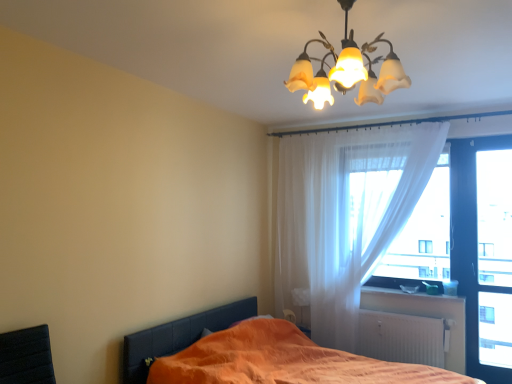
What is the approximate height of translucent fabric at right, arranged as the second window screen when viewed from the right?

translucent fabric at right, arranged as the second window screen when viewed from the right, is 4.60 feet in height.

At what (x,y) coordinates should I click in order to perform the action: click on white matte radiator at lower right. Please return your answer as a coordinate pair (x, y). Looking at the image, I should click on (403, 338).

The width and height of the screenshot is (512, 384). What are the coordinates of `orange fabric bed at lower left` in the screenshot? It's located at (292, 366).

From a real-world perspective, is translucent white curtain at upper right on translucent glass chandelier at upper center?

No, from a real-world perspective, translucent white curtain at upper right is not above translucent glass chandelier at upper center.

Looking at their sizes, would you say translucent white curtain at upper right is wider or thinner than translucent glass chandelier at upper center?

Clearly, translucent white curtain at upper right has less width compared to translucent glass chandelier at upper center.

Is translucent white curtain at upper right in contact with translucent glass chandelier at upper center?

translucent white curtain at upper right is not next to translucent glass chandelier at upper center, and they're not touching.

How far apart are orange fabric bed at lower left and white matte radiator at lower right?

The distance of orange fabric bed at lower left from white matte radiator at lower right is 27.83 inches.

Considering the relative sizes of orange fabric bed at lower left and white matte radiator at lower right in the image provided, is orange fabric bed at lower left smaller than white matte radiator at lower right?

Incorrect, orange fabric bed at lower left is not smaller in size than white matte radiator at lower right.

Is orange fabric bed at lower left looking in the opposite direction of white matte radiator at lower right?

No, orange fabric bed at lower left is not facing away from white matte radiator at lower right.

Based on the photo, is orange fabric bed at lower left positioned far away from white matte radiator at lower right?

Actually, orange fabric bed at lower left and white matte radiator at lower right are a little close together.

Is transparent glass door at right, the 1th window screen positioned from the right, behind orange fabric bed at lower left?

Yes, it is behind orange fabric bed at lower left.

Is transparent glass door at right, the 1th window screen positioned from the right, aimed at orange fabric bed at lower left?

No, transparent glass door at right, the 1th window screen positioned from the right, does not turn towards orange fabric bed at lower left.

How distant is transparent glass door at right, the 1th window screen positioned from the right, from orange fabric bed at lower left?

A distance of 1.49 meters exists between transparent glass door at right, the 1th window screen positioned from the right, and orange fabric bed at lower left.

Identify the location of radiator below the translucent glass chandelier at upper center (from the image's perspective). Image resolution: width=512 pixels, height=384 pixels. (403, 338).

How different are the orientations of translucent glass chandelier at upper center and white matte radiator at lower right in degrees?

The angular difference between translucent glass chandelier at upper center and white matte radiator at lower right is 1.68 degrees.

Would you say translucent glass chandelier at upper center is a long distance from white matte radiator at lower right?

Yes.

From a real-world perspective, between transparent glass door at right, marked as the 2th window screen in a left-to-right arrangement, and translucent glass chandelier at upper center, who is vertically higher?

In real-world perspective, translucent glass chandelier at upper center is above.

From the image's perspective, who appears lower, transparent glass door at right, marked as the 2th window screen in a left-to-right arrangement, or translucent glass chandelier at upper center?

transparent glass door at right, marked as the 2th window screen in a left-to-right arrangement.

Is transparent glass door at right, marked as the 2th window screen in a left-to-right arrangement, placed right next to translucent glass chandelier at upper center?

transparent glass door at right, marked as the 2th window screen in a left-to-right arrangement, and translucent glass chandelier at upper center are not in contact.

Choose the correct answer: Is transparent glass door at right, marked as the 2th window screen in a left-to-right arrangement, inside translucent glass chandelier at upper center or outside it?

transparent glass door at right, marked as the 2th window screen in a left-to-right arrangement, is located beyond the bounds of translucent glass chandelier at upper center.

Which is more to the right, white plastic window sill at lower right or white matte radiator at lower right?

white plastic window sill at lower right is more to the right.

Is point (437, 299) in front of point (381, 327)?

Yes, it is in front of point (381, 327).

Is white plastic window sill at lower right positioned with its back to white matte radiator at lower right?

That's not correct — white plastic window sill at lower right is not looking away from white matte radiator at lower right.

From a real-world perspective, is white plastic window sill at lower right above or below orange fabric bed at lower left?

From a real-world perspective, white plastic window sill at lower right is physically above orange fabric bed at lower left.

Can you confirm if white plastic window sill at lower right is wider than orange fabric bed at lower left?

Incorrect, the width of white plastic window sill at lower right does not surpass that of orange fabric bed at lower left.

Is white plastic window sill at lower right positioned before orange fabric bed at lower left?

No, it is behind orange fabric bed at lower left.

In the scene shown: Is orange fabric bed at lower left surrounded by white plastic window sill at lower right?

Definitely not — orange fabric bed at lower left is not inside white plastic window sill at lower right.

This screenshot has width=512, height=384. Identify the location of lamp on the left of translucent white curtain at upper right. (347, 70).

This screenshot has width=512, height=384. In the image, there is a white matte radiator at lower right. What are the coordinates of `bed below it (from the image's perspective)` in the screenshot? It's located at (292, 366).

Estimate the real-world distances between objects in this image. Which object is closer to translucent fabric at right, arranged as the second window screen when viewed from the right, translucent glass chandelier at upper center or transparent glass door at right, marked as the 2th window screen in a left-to-right arrangement?

transparent glass door at right, marked as the 2th window screen in a left-to-right arrangement, is closer to translucent fabric at right, arranged as the second window screen when viewed from the right.

When comparing their distances from white plastic window sill at lower right, does translucent fabric at right, placed as the first window screen when sorted from left to right, or translucent white curtain at upper right seem closer?

Among the two, translucent fabric at right, placed as the first window screen when sorted from left to right, is located nearer to white plastic window sill at lower right.

Which object lies nearer to the anchor point translucent glass chandelier at upper center, transparent glass door at right, the 1th window screen positioned from the right, or translucent fabric at right, placed as the first window screen when sorted from left to right?

Among the two, translucent fabric at right, placed as the first window screen when sorted from left to right, is located nearer to translucent glass chandelier at upper center.

Looking at the image, which one is located further to orange fabric bed at lower left, translucent glass chandelier at upper center or white plastic window sill at lower right?

translucent glass chandelier at upper center lies further to orange fabric bed at lower left than the other object.

Looking at the image, which one is located further to orange fabric bed at lower left, transparent glass door at right, the 1th window screen positioned from the right, or translucent white curtain at upper right?

The object further to orange fabric bed at lower left is transparent glass door at right, the 1th window screen positioned from the right.

Estimate the real-world distances between objects in this image. Which object is further from white plastic window sill at lower right, translucent fabric at right, placed as the first window screen when sorted from left to right, or orange fabric bed at lower left?

orange fabric bed at lower left is further to white plastic window sill at lower right.

Estimate the real-world distances between objects in this image. Which object is further from transparent glass door at right, the 1th window screen positioned from the right, white plastic window sill at lower right or translucent fabric at right, arranged as the second window screen when viewed from the right?

Based on the image, white plastic window sill at lower right appears to be further to transparent glass door at right, the 1th window screen positioned from the right.

Estimate the real-world distances between objects in this image. Which object is further from translucent white curtain at upper right, translucent fabric at right, placed as the first window screen when sorted from left to right, or white plastic window sill at lower right?

white plastic window sill at lower right lies further to translucent white curtain at upper right than the other object.

The height and width of the screenshot is (384, 512). I want to click on radiator positioned between translucent glass chandelier at upper center and white plastic window sill at lower right from near to far, so click(x=403, y=338).

You are a GUI agent. You are given a task and a screenshot of the screen. Output one action in this format:
    pyautogui.click(x=<x>, y=<y>)
    Task: Click on the window screen between translucent glass chandelier at upper center and translucent fabric at right, placed as the first window screen when sorted from left to right, along the z-axis
    Image resolution: width=512 pixels, height=384 pixels.
    Given the screenshot: What is the action you would take?
    pyautogui.click(x=492, y=270)

Where is `curtain positioned between orange fabric bed at lower left and white matte radiator at lower right from near to far`? curtain positioned between orange fabric bed at lower left and white matte radiator at lower right from near to far is located at coordinates (345, 215).

You are a GUI agent. You are given a task and a screenshot of the screen. Output one action in this format:
    pyautogui.click(x=<x>, y=<y>)
    Task: Click on the curtain between translucent glass chandelier at upper center and translucent fabric at right, placed as the first window screen when sorted from left to right, from front to back
    
    Given the screenshot: What is the action you would take?
    pyautogui.click(x=345, y=215)